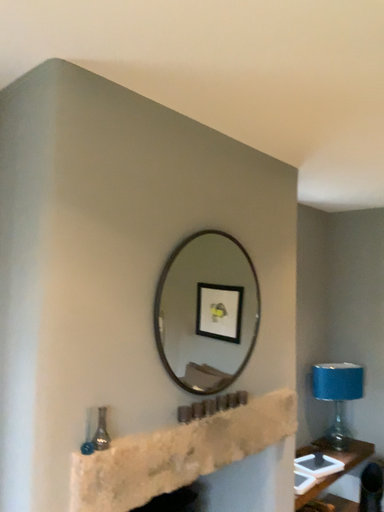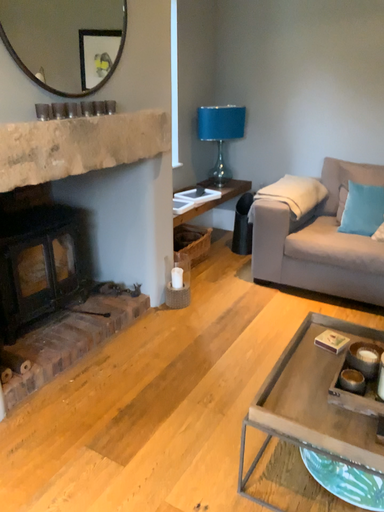
Question: How did the camera likely rotate when shooting the video?

Choices:
 (A) rotated upward
 (B) rotated downward

Answer: (B)